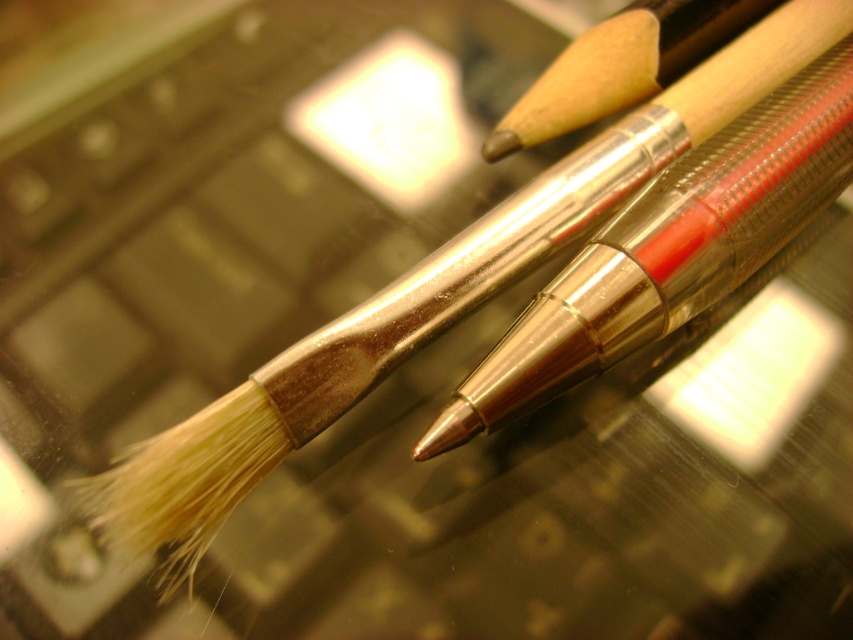
What object is located at the coordinates point (670, 250) in the image?

The point (670, 250) indicates the location of the matte metallic paint brush at center.

You are a photographer holding a camera 1.25 meters away from the matte metallic paint brush at center. Can you capture the entire brush in one frame without moving the camera?

The matte metallic paint brush at center and camera are 1.25 meters apart. Since the distance is fixed, whether the entire brush can be captured depends on the camera lens focal length and field of view. A wide angle lens would likely include the whole brush, while a telephoto lens might only capture part of it. Without knowing the lens specifications, it is impossible to determine for certain.

You are an artist trying to reach for the matte metallic paint brush at center and the wooden paint brush at upper right. Which one is closer to your hand if your hand is positioned at the bottom of the image?

The matte metallic paint brush at center is closer to your hand because it is located below the wooden paint brush at upper right.